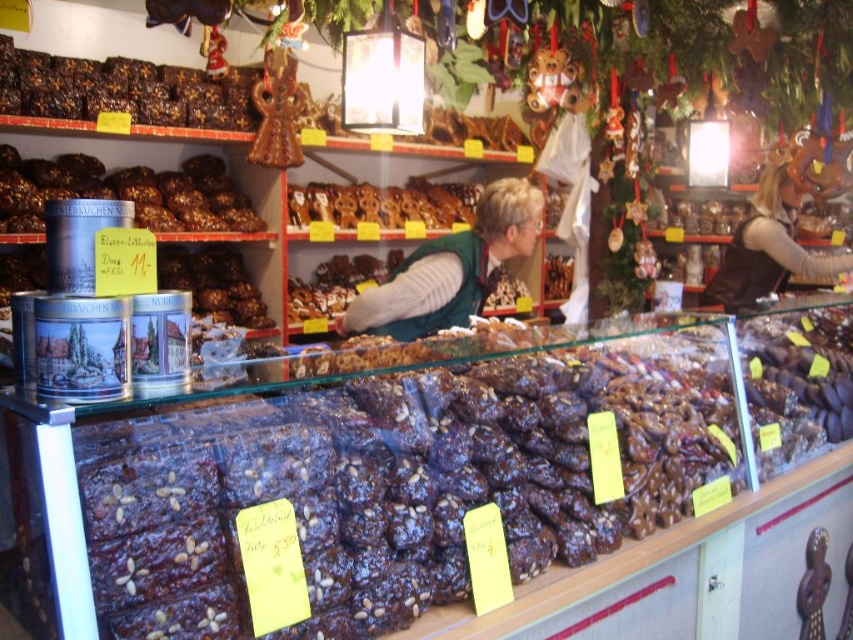
Question: Which point is farther from the camera taking this photo?

Choices:
 (A) (51, 99)
 (B) (763, 227)
 (C) (453, 220)

Answer: (C)

Question: Which of these objects is positioned farthest from the dark chocolate cake at upper left?

Choices:
 (A) green fabric vest at center
 (B) brown leather vest at right

Answer: (B)

Question: Can you confirm if dark chocolate cake at upper left is positioned above brown glazed gingerbread at center?

Choices:
 (A) no
 (B) yes

Answer: (B)

Question: Can you confirm if dark chocolate cake at upper left is positioned above green fabric vest at center?

Choices:
 (A) no
 (B) yes

Answer: (B)

Question: Is the position of brown leather vest at right less distant than that of brown glazed gingerbread at center?

Choices:
 (A) no
 (B) yes

Answer: (A)

Question: Which point is closer to the camera?

Choices:
 (A) dark chocolate cake at upper left
 (B) brown leather vest at right
 (C) brown glazed gingerbread at center
 (D) green fabric vest at center

Answer: (A)